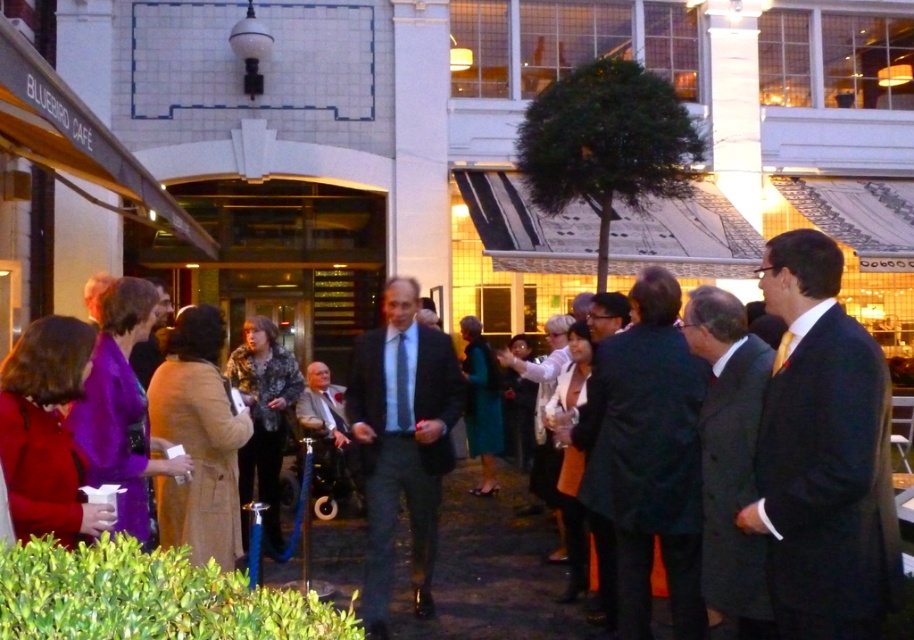
You are standing at the Bluebird Cafe and want to move from the first point to the second point. Which direction should you move to get from point (x=795, y=547) to point (x=647, y=547)?

To move from point (x=795, y=547) to point (x=647, y=547), you should move backward since the second point is behind the first point.

You are attending an event at the Bluebird Cafe and need to locate two people dressed in formal attire. One is wearing a dark suit at right, and the other is in a black wool coat at center. Which person is standing to the right of the other?

The dark suit at right is positioned on the right side of black wool coat at center, so the person in the dark suit at right is to the right of the person in the black wool coat at center.

You are attending an event at the Bluebird Cafe and notice two attendees dressed in formal wear. One is wearing a black wool coat at center and the other a dark gray suit at center. From your perspective facing the building, which clothing item is positioned to the left?

The black wool coat at center is to the left of the dark gray suit at center.